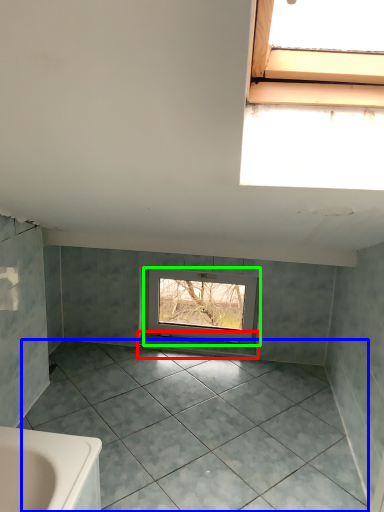
Question: Which object is the farthest from window sill (highlighted by a red box)? Choose among these: ceramic tile (highlighted by a blue box) or window (highlighted by a green box).

Choices:
 (A) ceramic tile
 (B) window

Answer: (A)